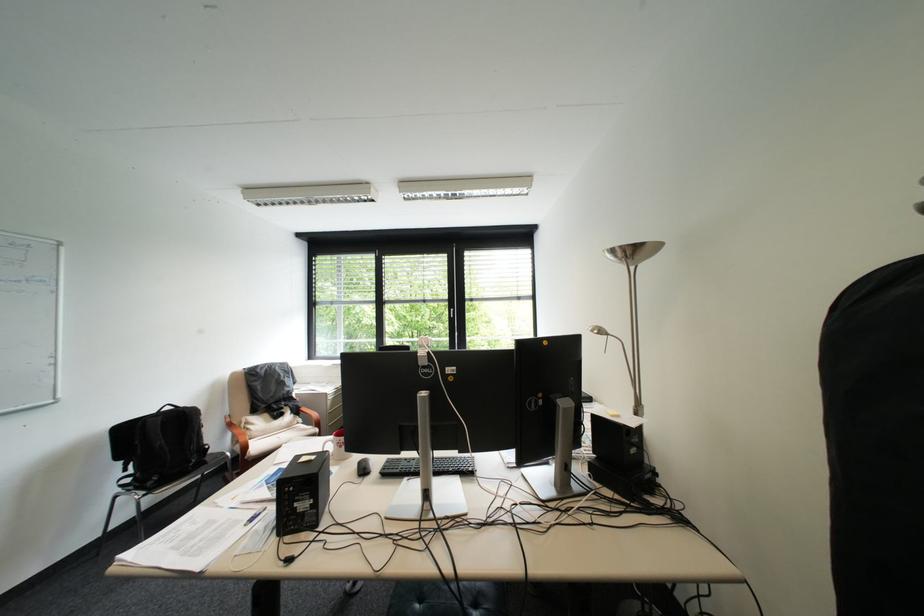
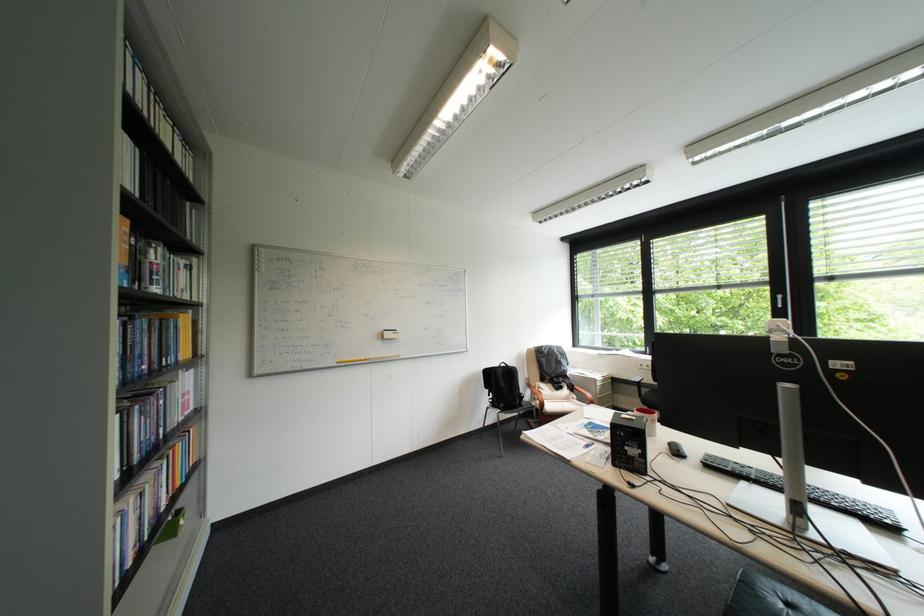
Question: I am providing you with two images of the same scene from different viewpoints. Which of the following objects are not visible in image2?

Choices:
 (A) chair sitting surface
 (B) black computer mouse
 (C) book
 (D) none of these

Answer: (D)